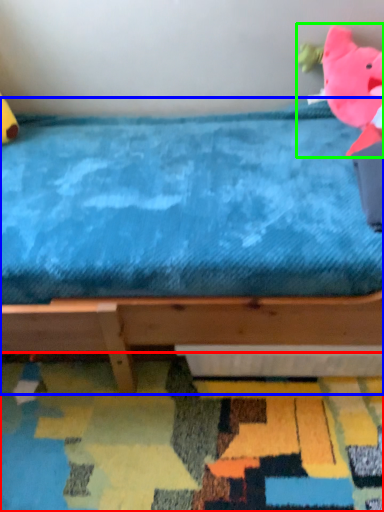
Question: Considering the real-world distances, which object is closest to mat (highlighted by a red box)? bed (highlighted by a blue box) or toy (highlighted by a green box).

Choices:
 (A) bed
 (B) toy

Answer: (A)